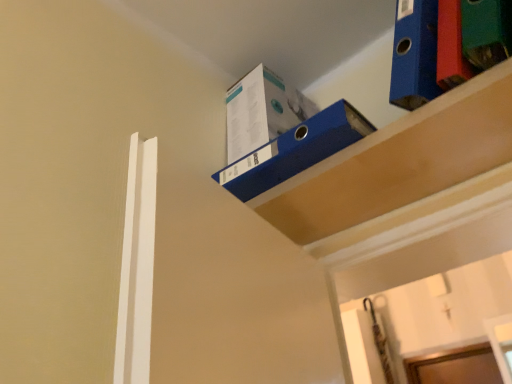
Question: In the image, is blue cardboard box at upper center positioned in front of or behind blue cardboard box at upper center, marked as the first shelf in a left-to-right arrangement?

Choices:
 (A) front
 (B) behind

Answer: (B)

Question: Is blue cardboard box at upper center taller or shorter than blue cardboard box at upper center, marked as the first shelf in a left-to-right arrangement?

Choices:
 (A) short
 (B) tall

Answer: (B)

Question: Estimate the real-world distances between objects in this image. Which object is farther from the blue cardboard box at upper right, the 2th shelf from the left?

Choices:
 (A) blue cardboard box at upper center
 (B) blue cardboard box at upper center, which ranks as the second shelf in right-to-left order

Answer: (A)

Question: Estimate the real-world distances between objects in this image. Which object is farther from the blue cardboard box at upper right, the first shelf viewed from the right?

Choices:
 (A) blue cardboard box at upper center
 (B) blue cardboard box at upper center, which ranks as the second shelf in right-to-left order

Answer: (A)